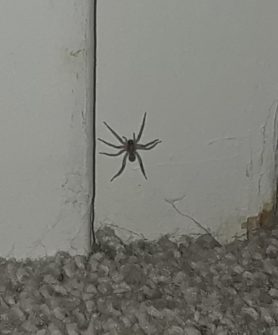
This screenshot has height=335, width=278. Find the location of `empty space on the bottom of the wall`. empty space on the bottom of the wall is located at coordinates (x=138, y=207).